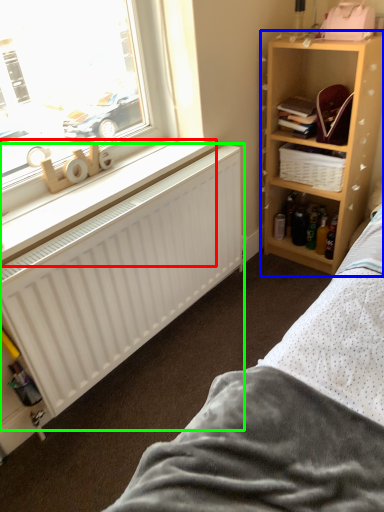
Question: Based on their relative distances, which object is farther from window sill (highlighted by a red box)? Choose from shelf (highlighted by a blue box) and radiator (highlighted by a green box).

Choices:
 (A) shelf
 (B) radiator

Answer: (A)